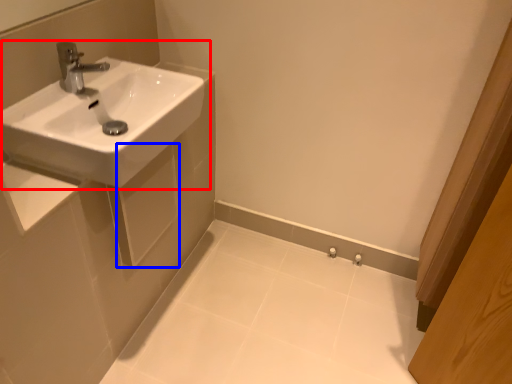
Question: Which object appears closest to the camera in this image, sink (highlighted by a red box) or square (highlighted by a blue box)?

Choices:
 (A) sink
 (B) square

Answer: (A)